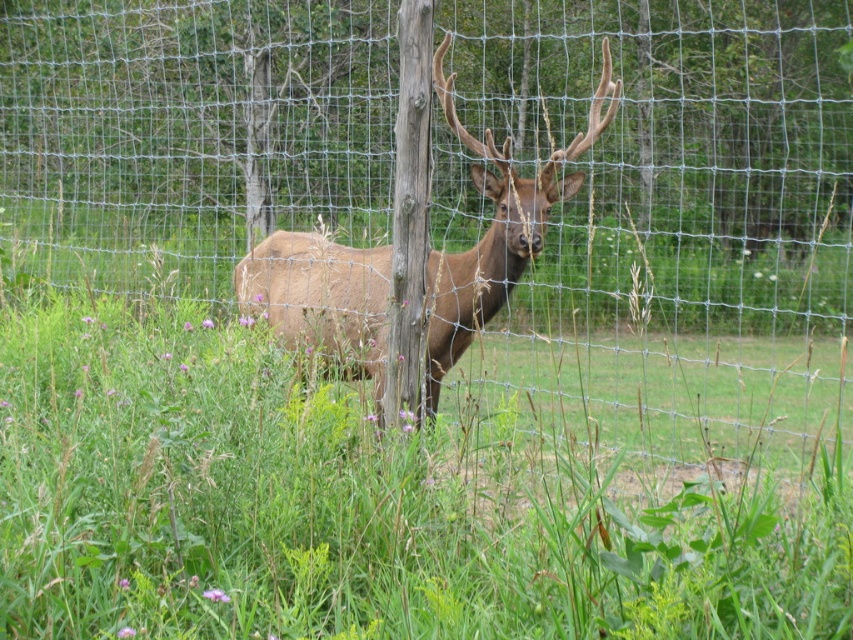
You are standing in front of the elk enclosure and want to take a photo of the point at coordinates point (207, 10). If your camera has a maximum focus range of 30 feet, will it be able to focus on that point?

The distance of point (207, 10) from viewer is 33.59 feet, which exceeds the camera maximum focus range of 30 feet. So the camera cannot focus on that point.

You are a zookeeper who needs to feed the elk behind the wire mesh fence at center. You have a food tray that is 3 meters long. Can you place the food tray so that it reaches from your side of the fence to the elk on the other side?

The distance between you and the wire mesh fence at center is 3.57 meters. Since the food tray is only 3 meters long, it is not long enough to span the gap. You will need a longer tray or another method to reach the elk.

You are standing in front of the elk enclosure and want to take a photo of both the elk and the wooden post. The elk is at point (448, 440) and the wooden post is at point (589, 140). Which point should you focus on first to ensure both are in the frame?

You should focus on point (448, 440) first because it is in front of point (589, 140), ensuring both the elk and the wooden post are visible in the frame.